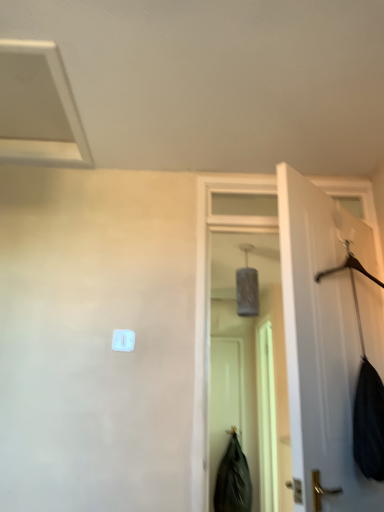
Question: From a real-world perspective, is white plastic light switch at center positioned under white matte door at right based on gravity?

Choices:
 (A) no
 (B) yes

Answer: (A)

Question: Considering the relative sizes of white plastic light switch at center and white matte door at right in the image provided, is white plastic light switch at center taller than white matte door at right?

Choices:
 (A) no
 (B) yes

Answer: (A)

Question: Is white plastic light switch at center in front of white matte door at right?

Choices:
 (A) yes
 (B) no

Answer: (B)

Question: From the image's perspective, is white plastic light switch at center located beneath white matte door at right?

Choices:
 (A) yes
 (B) no

Answer: (A)

Question: Does white plastic light switch at center appear on the right side of white matte door at right?

Choices:
 (A) no
 (B) yes

Answer: (A)

Question: Considering the relative sizes of white plastic light switch at center and white matte door at right in the image provided, is white plastic light switch at center wider than white matte door at right?

Choices:
 (A) no
 (B) yes

Answer: (A)

Question: Can you confirm if white matte door at right is positioned to the left of translucent plastic screen door at center, which is the 1th screen door in right-to-left order?

Choices:
 (A) yes
 (B) no

Answer: (A)

Question: Could translucent plastic screen door at center, positioned as the second screen door in left-to-right order, be considered to be inside white matte door at right?

Choices:
 (A) no
 (B) yes

Answer: (A)

Question: Can you confirm if white matte door at right is positioned to the right of translucent plastic screen door at center, positioned as the second screen door in left-to-right order?

Choices:
 (A) yes
 (B) no

Answer: (B)

Question: Is white matte door at right wider than translucent plastic screen door at center, which is the 1th screen door in right-to-left order?

Choices:
 (A) yes
 (B) no

Answer: (B)

Question: Is white matte door at right taller than translucent plastic screen door at center, positioned as the second screen door in left-to-right order?

Choices:
 (A) yes
 (B) no

Answer: (B)

Question: Is white matte door at right oriented towards translucent plastic screen door at center, which is the 1th screen door in right-to-left order?

Choices:
 (A) no
 (B) yes

Answer: (A)

Question: Does black matte screen door at center, the first screen door when ordered from left to right, have a lesser height compared to black matte coat at lower center?

Choices:
 (A) no
 (B) yes

Answer: (A)